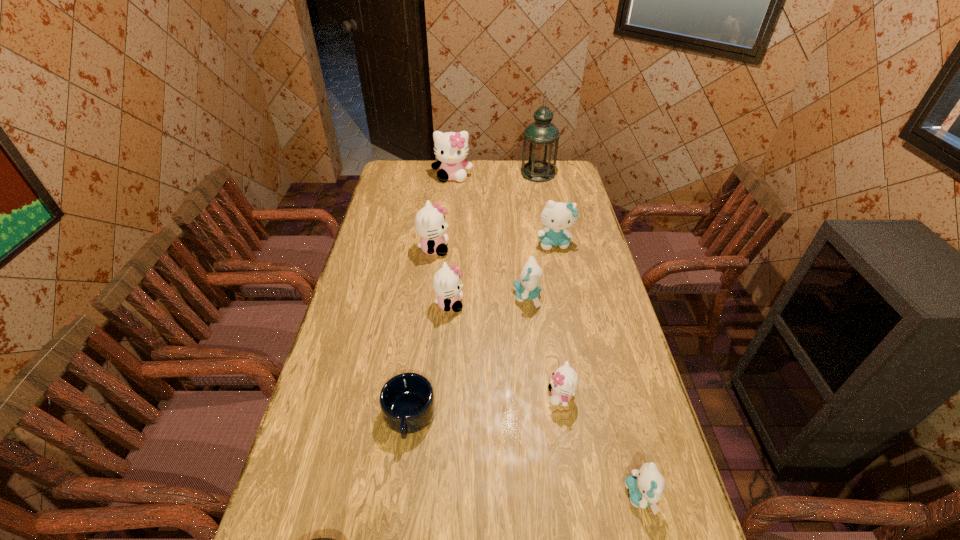
At what (x,y) coordinates should I click in order to perform the action: click on vacant region located on the face of the second nearest blue kitten. Please return your answer as a coordinate pair (x, y). Looking at the image, I should click on (485, 296).

In order to click on free point located 0.260m on the face of the second nearest blue kitten in this screenshot , I will do `click(439, 296)`.

At what (x,y) coordinates should I click in order to perform the action: click on free space located on the front-facing side of the third farthest white kitten. Please return your answer as a coordinate pair (x, y). This screenshot has width=960, height=540. Looking at the image, I should click on (525, 304).

Identify the location of free region located 0.240m on the front-facing side of the second nearest kitten. (462, 396).

Where is `vacant space located on the front-facing side of the second nearest kitten`? vacant space located on the front-facing side of the second nearest kitten is located at coordinates [x=530, y=396].

Find the location of a particular element. Image resolution: width=960 pixels, height=540 pixels. vacant space located on the front-facing side of the second nearest kitten is located at coordinates (512, 396).

Locate an element on the screen. The height and width of the screenshot is (540, 960). free region located on the face of the nearest kitten is located at coordinates (528, 496).

Where is `vacant space situated 0.130m on the face of the nearest kitten`? The image size is (960, 540). vacant space situated 0.130m on the face of the nearest kitten is located at coordinates (570, 496).

At what (x,y) coordinates should I click in order to perform the action: click on free space located 0.060m on the face of the nearest kitten. Please return your answer as a coordinate pair (x, y). Looking at the image, I should click on (600, 496).

The height and width of the screenshot is (540, 960). I want to click on vacant region located with the handle on the side of the blue mug, so click(x=402, y=466).